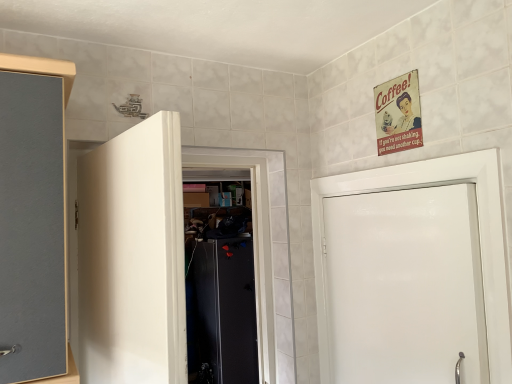
Question: Looking at the image, does white glossy door at right, positioned as the first door in right-to-left order, seem bigger or smaller compared to white matte door at center, which ranks as the 2th door in right-to-left order?

Choices:
 (A) big
 (B) small

Answer: (B)

Question: Does point (477, 170) appear closer or farther from the camera than point (80, 364)?

Choices:
 (A) farther
 (B) closer

Answer: (B)

Question: Is white glossy door at right, the second door viewed from the left, inside the boundaries of white matte door at center, marked as the first door in a left-to-right arrangement, or outside?

Choices:
 (A) inside
 (B) outside

Answer: (B)

Question: From the image's perspective, relative to white glossy door at right, positioned as the first door in right-to-left order, is white matte door at center, which ranks as the 2th door in right-to-left order, above or below?

Choices:
 (A) above
 (B) below

Answer: (A)

Question: Is white matte door at center, marked as the first door in a left-to-right arrangement, to the left or to the right of white glossy door at right, positioned as the first door in right-to-left order, in the image?

Choices:
 (A) left
 (B) right

Answer: (A)

Question: Is point (150, 119) closer or farther from the camera than point (496, 311)?

Choices:
 (A) farther
 (B) closer

Answer: (B)

Question: From a real-world perspective, is white matte door at center, marked as the first door in a left-to-right arrangement, positioned above or below white glossy door at right, positioned as the first door in right-to-left order?

Choices:
 (A) above
 (B) below

Answer: (A)